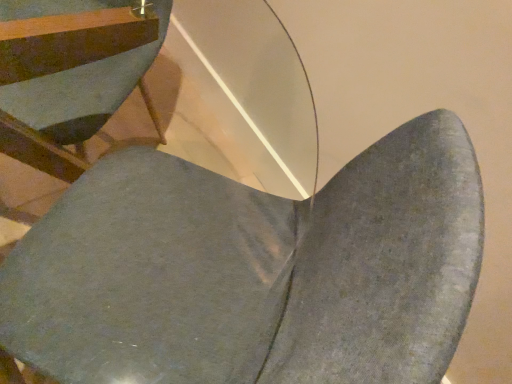
Question: In terms of size, does matte gray chair at lower left, arranged as the second chair when viewed from the right, appear bigger or smaller than matte gray chair at center, which is the first chair in right-to-left order?

Choices:
 (A) small
 (B) big

Answer: (A)

Question: Is point (158, 124) positioned closer to the camera than point (215, 369)?

Choices:
 (A) farther
 (B) closer

Answer: (A)

Question: Considering the positions of matte gray chair at lower left, the first chair positioned from the left, and matte gray chair at center, which is the first chair in right-to-left order, in the image, is matte gray chair at lower left, the first chair positioned from the left, taller or shorter than matte gray chair at center, which is the first chair in right-to-left order,?

Choices:
 (A) tall
 (B) short

Answer: (B)

Question: From a real-world perspective, relative to matte gray chair at lower left, arranged as the second chair when viewed from the right, is matte gray chair at center, marked as the second chair in a left-to-right arrangement, vertically above or below?

Choices:
 (A) below
 (B) above

Answer: (B)

Question: In terms of width, does matte gray chair at center, marked as the second chair in a left-to-right arrangement, look wider or thinner when compared to matte gray chair at lower left, the first chair positioned from the left?

Choices:
 (A) wide
 (B) thin

Answer: (B)

Question: Is matte gray chair at center, marked as the second chair in a left-to-right arrangement, bigger or smaller than matte gray chair at lower left, arranged as the second chair when viewed from the right?

Choices:
 (A) small
 (B) big

Answer: (B)

Question: Considering their positions, is matte gray chair at center, which is the first chair in right-to-left order, located in front of or behind matte gray chair at lower left, arranged as the second chair when viewed from the right?

Choices:
 (A) behind
 (B) front

Answer: (B)